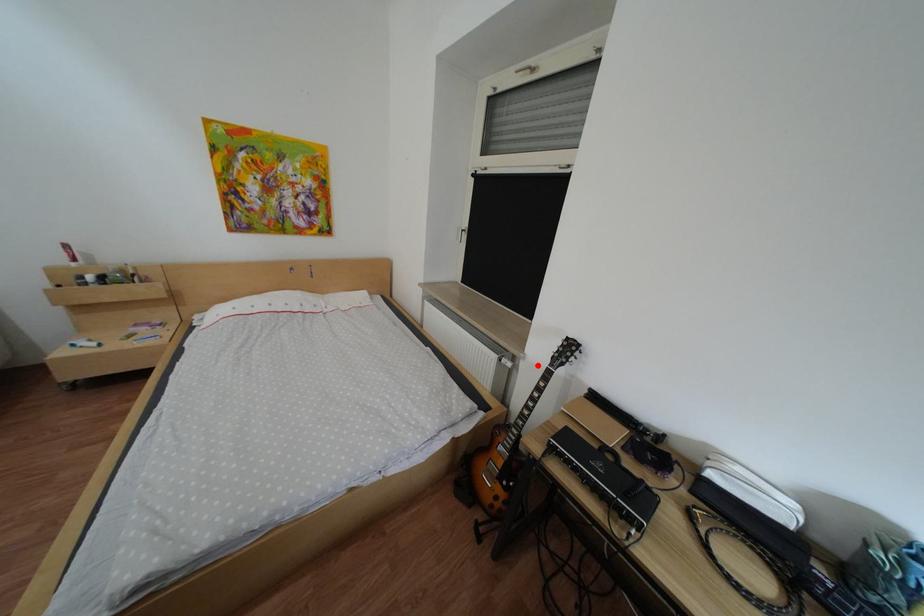
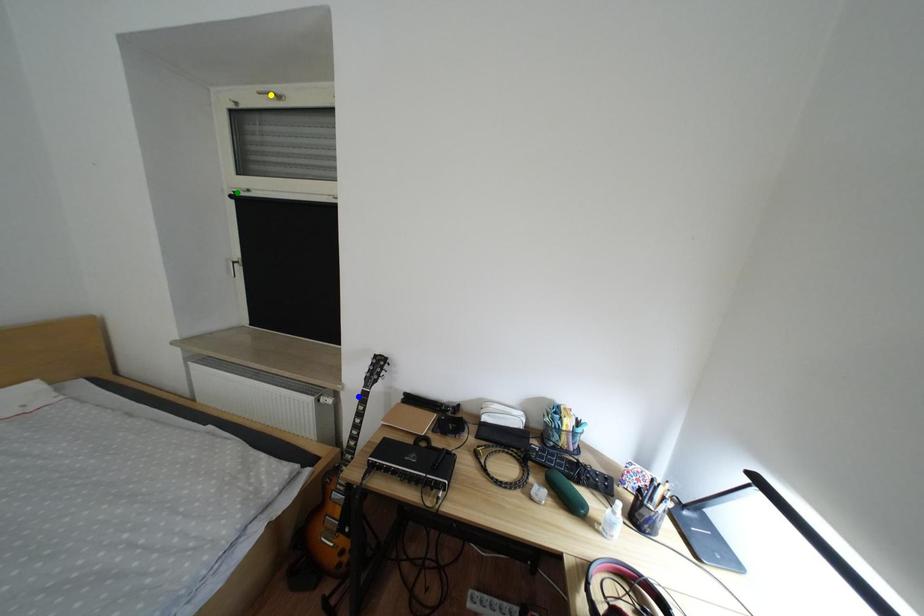
Question: I am providing you with two images of the same scene from different viewpoints. A red point is marked on the first image. You are given multiple points on the second image. Can you choose the point in image 2 that corresponds to the point in image 1?

Choices:
 (A) blue point
 (B) yellow point
 (C) green point

Answer: (A)